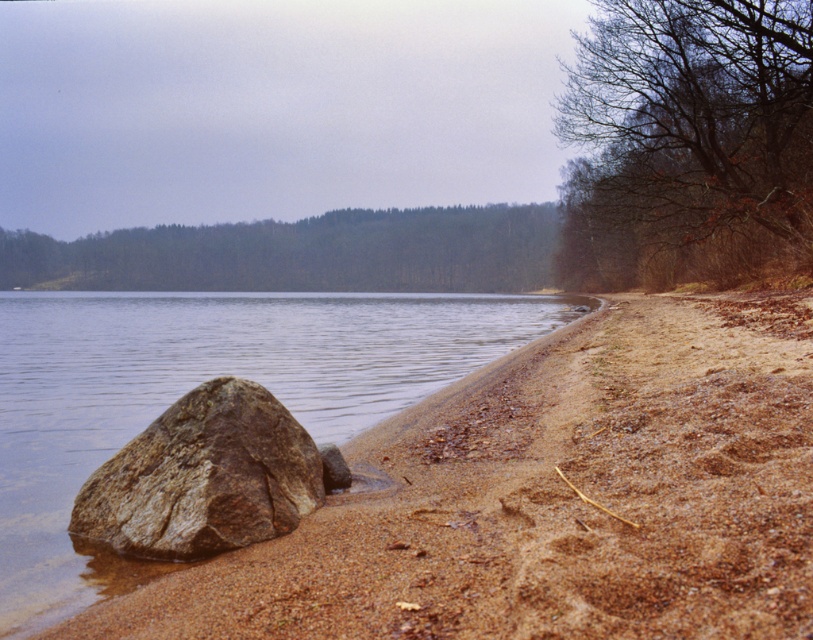
Question: Does brown leafy tree at upper right have a smaller size compared to brown rough rock at lower left?

Choices:
 (A) no
 (B) yes

Answer: (A)

Question: Can you confirm if brown leafy tree at upper right is positioned below brown rough rock at lower left?

Choices:
 (A) yes
 (B) no

Answer: (B)

Question: Observing the image, what is the correct spatial positioning of brown leafy tree at upper right in reference to green leafy forest at upper center?

Choices:
 (A) right
 (B) left

Answer: (A)

Question: Which object is closer to the camera taking this photo?

Choices:
 (A) brown leafy tree at upper right
 (B) green leafy forest at upper center

Answer: (A)

Question: Which point is closer to the camera taking this photo?

Choices:
 (A) (68, 529)
 (B) (664, 266)
 (C) (363, 269)
 (D) (153, 301)

Answer: (A)

Question: Among these points, which one is farthest from the camera?

Choices:
 (A) (77, 268)
 (B) (98, 582)

Answer: (A)